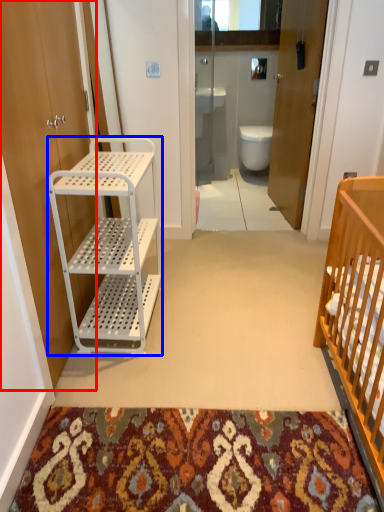
Question: Which object appears farthest to the camera in this image, door (highlighted by a red box) or cabinetry (highlighted by a blue box)?

Choices:
 (A) door
 (B) cabinetry

Answer: (B)